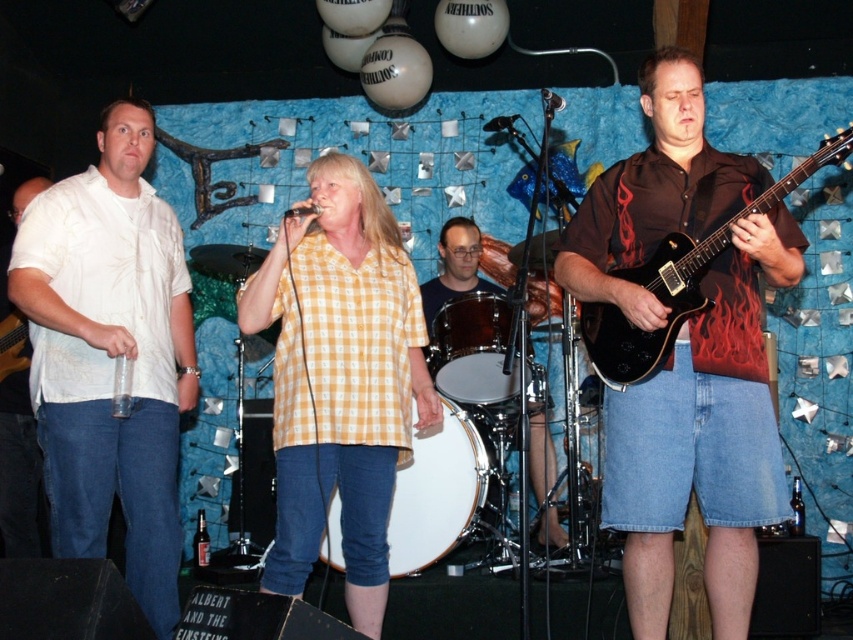
Question: From the image, what is the correct spatial relationship of shiny silver drum at center in relation to matte black electric guitar at left?

Choices:
 (A) below
 (B) above

Answer: (B)

Question: Does smooth white drum at center lie behind shiny silver drum at center?

Choices:
 (A) yes
 (B) no

Answer: (B)

Question: Based on their relative distances, which object is nearer to the matte black electric guitar at left?

Choices:
 (A) yellow checkered shirt at center
 (B) smooth white drum at center

Answer: (A)

Question: Is black glossy guitar at center wider than white cotton shirt at left?

Choices:
 (A) no
 (B) yes

Answer: (B)

Question: Which of these objects is positioned closest to the white drumhead at center?

Choices:
 (A) white cotton shirt at left
 (B) shiny silver drum at center
 (C) yellow checkered shirt at center

Answer: (C)

Question: Which of the following is the farthest from the observer?

Choices:
 (A) (473, 253)
 (B) (433, 332)

Answer: (A)